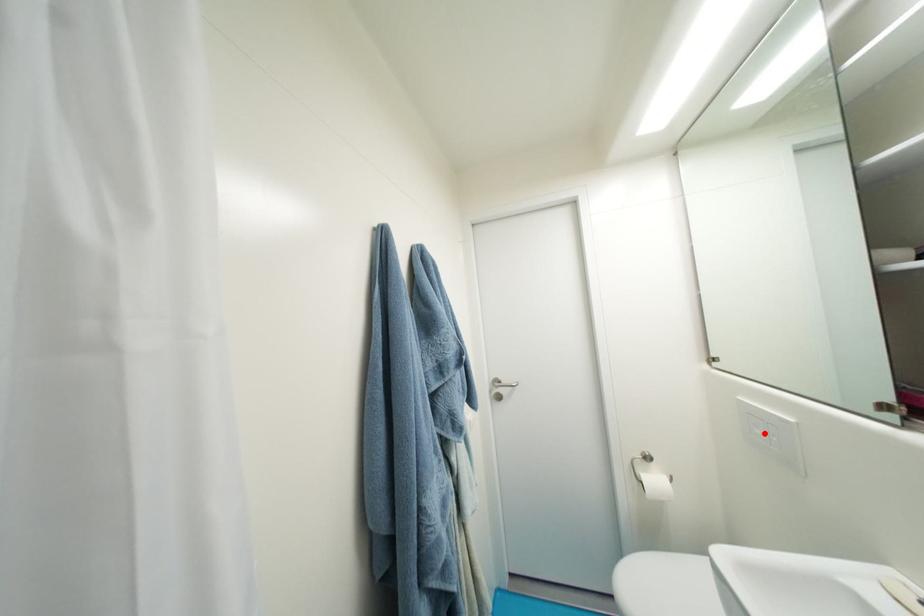
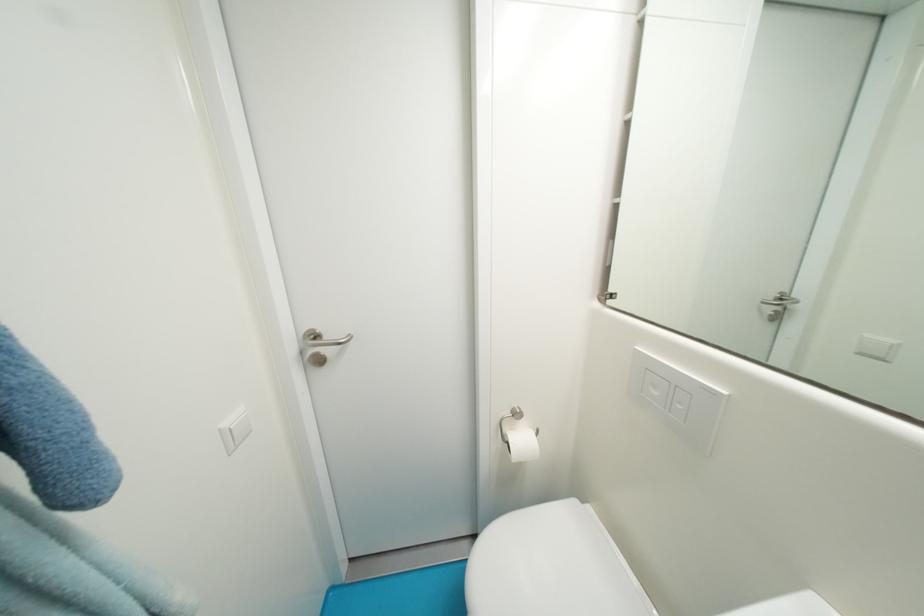
In the second image, find the point that corresponds to the highlighted location in the first image.

(662, 395)